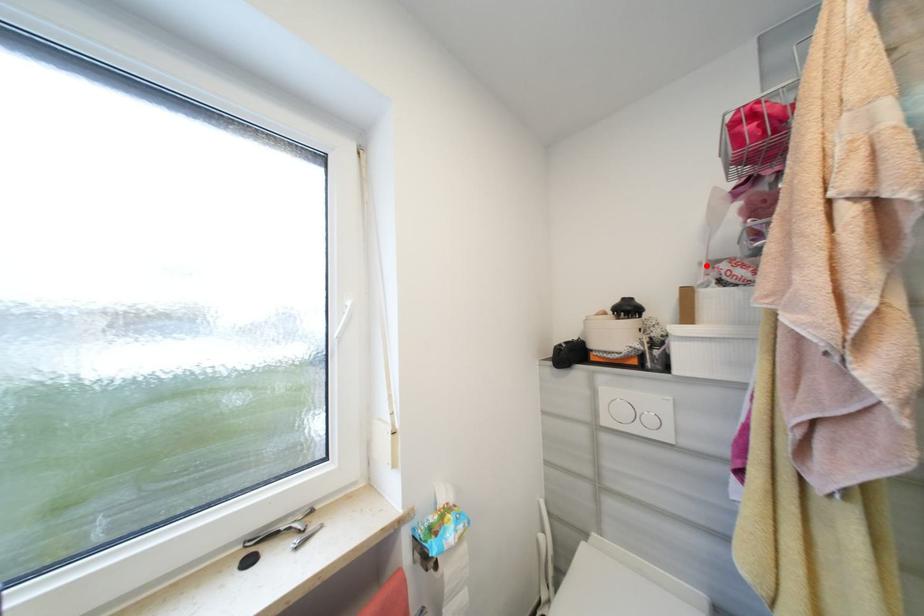
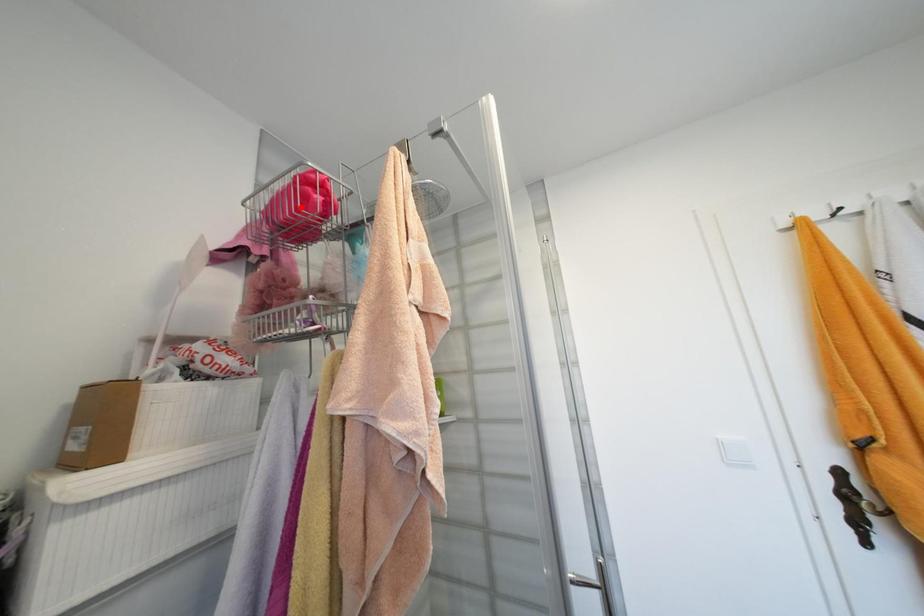
I am providing you with two images of the same scene from different viewpoints. A red point is marked on the first image and another point is marked on the second image. Is the red point in image1 aligned with the point shown in image2?

No